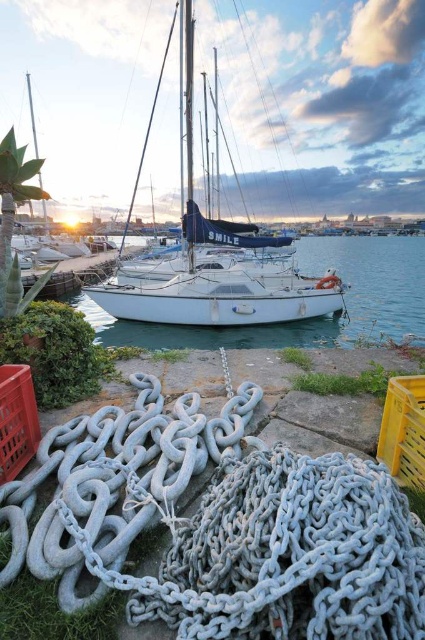
Does white matte sailboat at center have a larger size compared to metallic mast at upper center?

Incorrect, white matte sailboat at center is not larger than metallic mast at upper center.

Between white matte sailboat at center and metallic mast at upper center, which one is positioned lower?

Positioned lower is white matte sailboat at center.

Is point (274, 269) behind point (36, 150)?

No.

Where is `white matte sailboat at center`? white matte sailboat at center is located at coordinates (218, 268).

Which is more to the left, white matte water at center or yellow plastic crate at lower right?

yellow plastic crate at lower right is more to the left.

Which is behind, point (419, 316) or point (393, 444)?

Point (419, 316)

Is point (376, 332) positioned before point (424, 477)?

That is False.

At what (x,y) coordinates should I click in order to perform the action: click on white matte water at center. Please return your answer as a coordinate pair (x, y). Looking at the image, I should click on (311, 320).

Is point (48, 472) farther from viewer compared to point (2, 412)?

No, (48, 472) is closer to viewer.

At what (x,y) coordinates should I click in order to perform the action: click on galvanized metal chain at lower center. Please return your answer as a coordinate pair (x, y). This screenshot has height=640, width=425. Looking at the image, I should click on (221, 525).